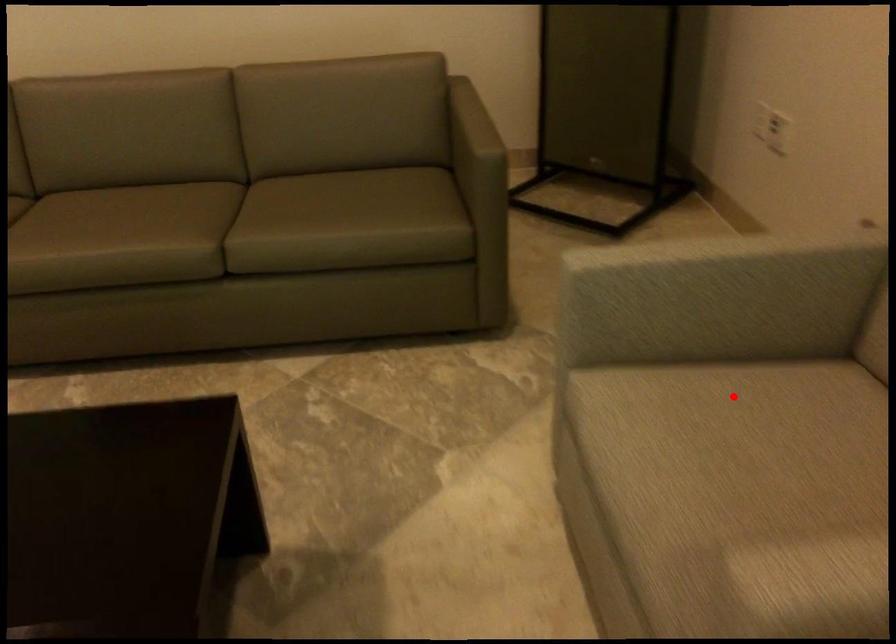
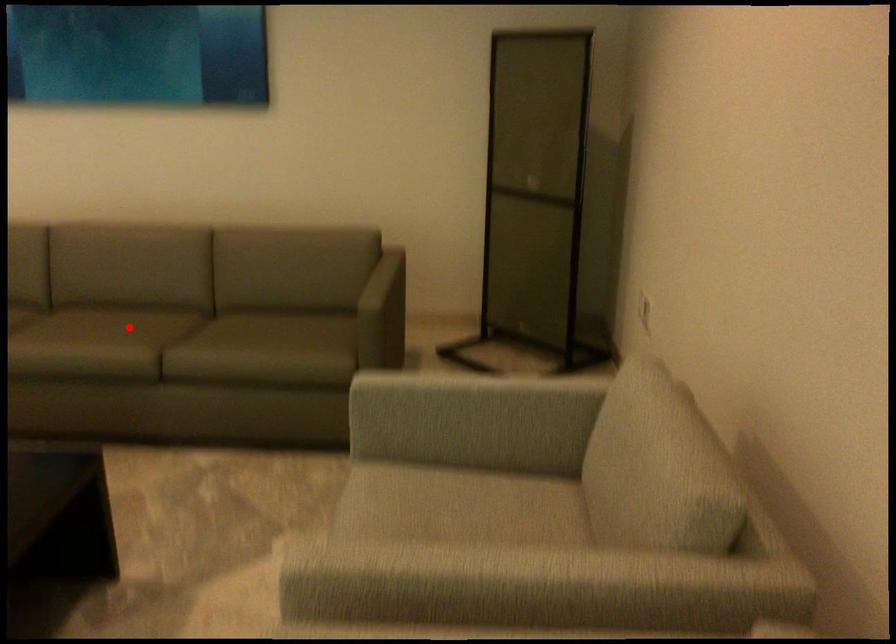
I am providing you with two images of the same scene from different viewpoints. A red point is marked on the first image and another point is marked on the second image. Is the red point in image1 aligned with the point shown in image2?

No